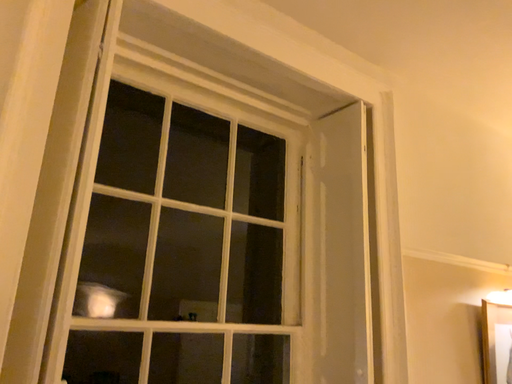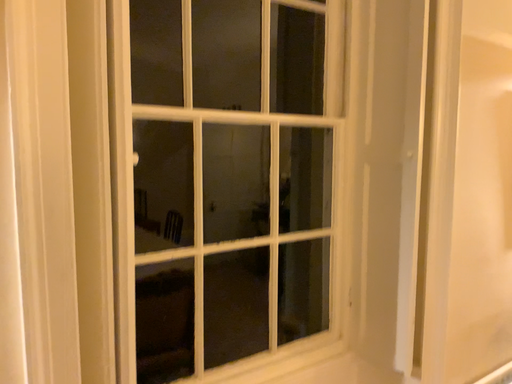
Question: Which way did the camera rotate in the video?

Choices:
 (A) rotated upward
 (B) rotated downward

Answer: (B)